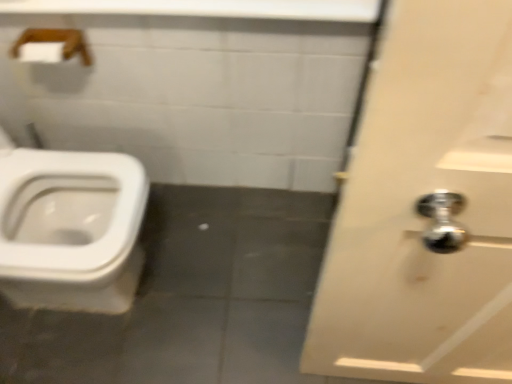
Question: Should I look upward or downward to see white glossy door at right?

Choices:
 (A) down
 (B) up

Answer: (A)

Question: Is white glossy counter top at upper center located outside white glossy door at right?

Choices:
 (A) no
 (B) yes

Answer: (B)

Question: Is white glossy counter top at upper center further to the viewer compared to white glossy door at right?

Choices:
 (A) no
 (B) yes

Answer: (B)

Question: Is white glossy door at right located within white glossy counter top at upper center?

Choices:
 (A) no
 (B) yes

Answer: (A)

Question: Considering the relative sizes of white glossy counter top at upper center and white glossy door at right in the image provided, is white glossy counter top at upper center taller than white glossy door at right?

Choices:
 (A) yes
 (B) no

Answer: (B)

Question: From the image's perspective, is white glossy counter top at upper center over white glossy door at right?

Choices:
 (A) no
 (B) yes

Answer: (B)

Question: Is white glossy counter top at upper center positioned before white glossy door at right?

Choices:
 (A) yes
 (B) no

Answer: (B)

Question: Can you see wooden towel bar at upper left touching white glossy counter top at upper center?

Choices:
 (A) yes
 (B) no

Answer: (B)

Question: Does wooden towel bar at upper left appear on the left side of white glossy counter top at upper center?

Choices:
 (A) yes
 (B) no

Answer: (A)

Question: From the image's perspective, is wooden towel bar at upper left under white glossy counter top at upper center?

Choices:
 (A) no
 (B) yes

Answer: (B)

Question: Is wooden towel bar at upper left far from white glossy counter top at upper center?

Choices:
 (A) yes
 (B) no

Answer: (B)

Question: Does wooden towel bar at upper left have a smaller size compared to white glossy counter top at upper center?

Choices:
 (A) yes
 (B) no

Answer: (A)

Question: Is wooden towel bar at upper left outside of white glossy counter top at upper center?

Choices:
 (A) no
 (B) yes

Answer: (B)

Question: Can you confirm if white glossy door at right is taller than wooden towel bar at upper left?

Choices:
 (A) yes
 (B) no

Answer: (A)